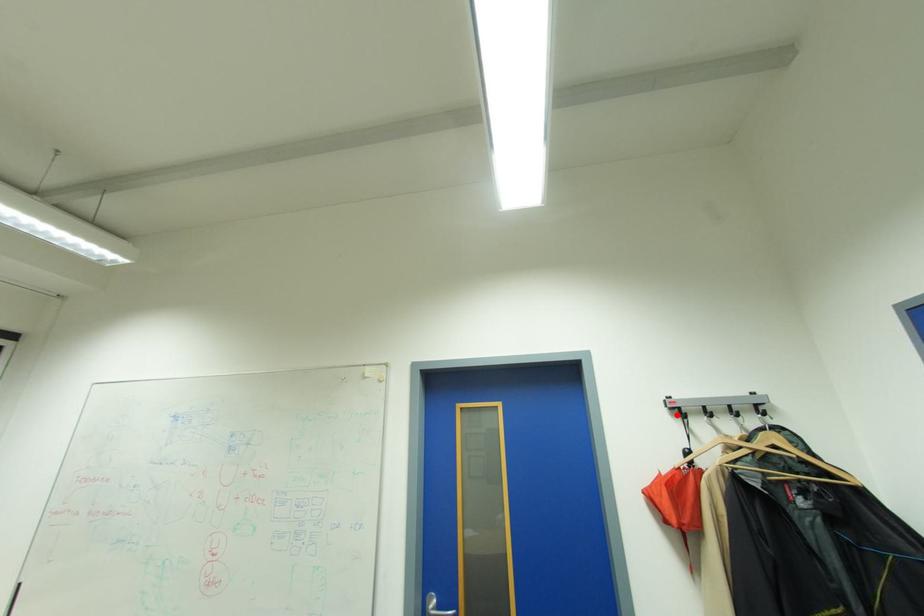
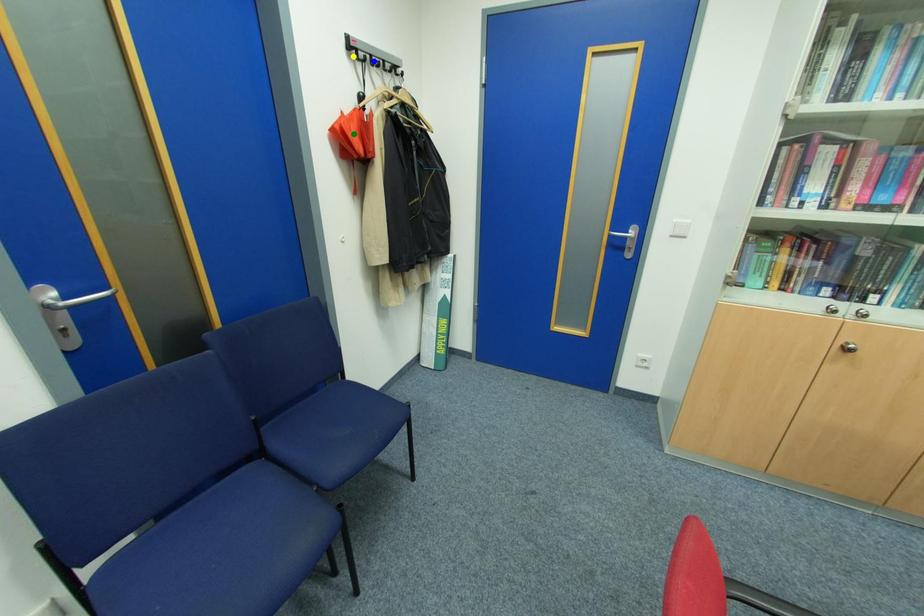
Question: I am providing you with two images of the same scene from different viewpoints. A red point is marked on the first image. You are given multiple points on the second image. Which point in image 2 is actually the same real-world point as the red point in image 1?

Choices:
 (A) blue point
 (B) yellow point
 (C) green point

Answer: (B)